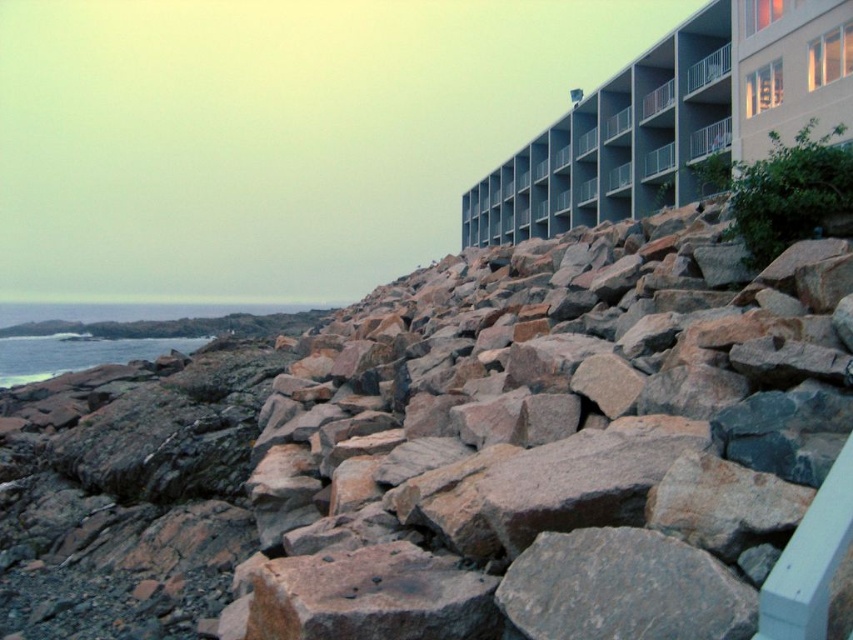
You are standing on the rocky shoreline and want to reach the multi story building to the right. Which object, the rusty stone boulder at center or the smooth blue water at lower left, is closer to your current position?

The smooth blue water at lower left is closer to your current position because the rusty stone boulder at center is to the right of it, meaning the water is between you and the boulder.

You are standing at the origin point of the coordinate system in the image. Which direction should you move to reach the rusty stone boulder at center?

The rusty stone boulder at center is located at coordinate point 0.702 in the x direction and 0.664 in the y direction. Since you are at the origin, you should move right along the x axis to 0.702 and up along the y axis to 0.664 to reach it.

Based on the photo, you are a photographer trying to capture the rusty stone boulder at center and the smooth blue water at lower left in the same frame. Based on their sizes, which object would appear larger in the photo?

The rusty stone boulder at center would appear larger in the photo because it is much taller than the smooth blue water at lower left.